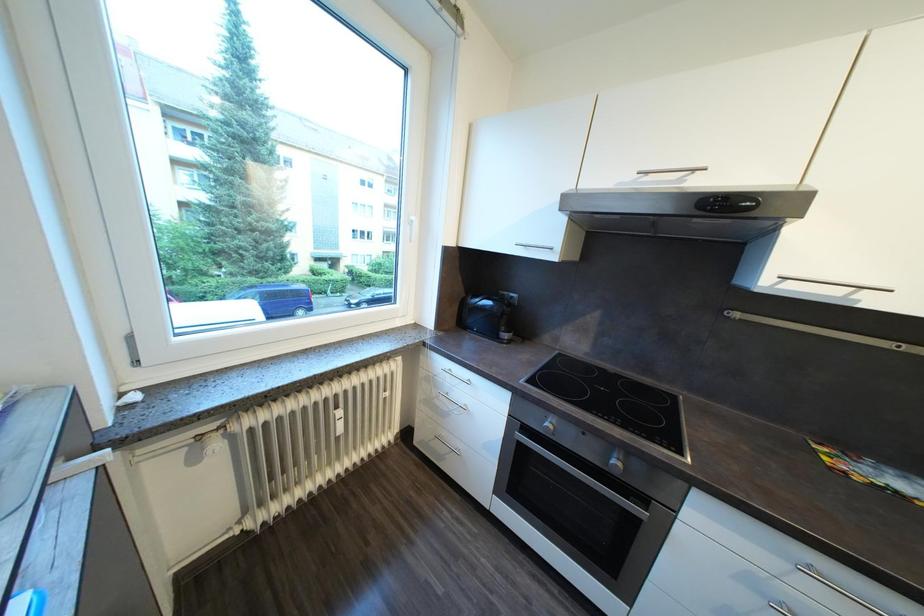
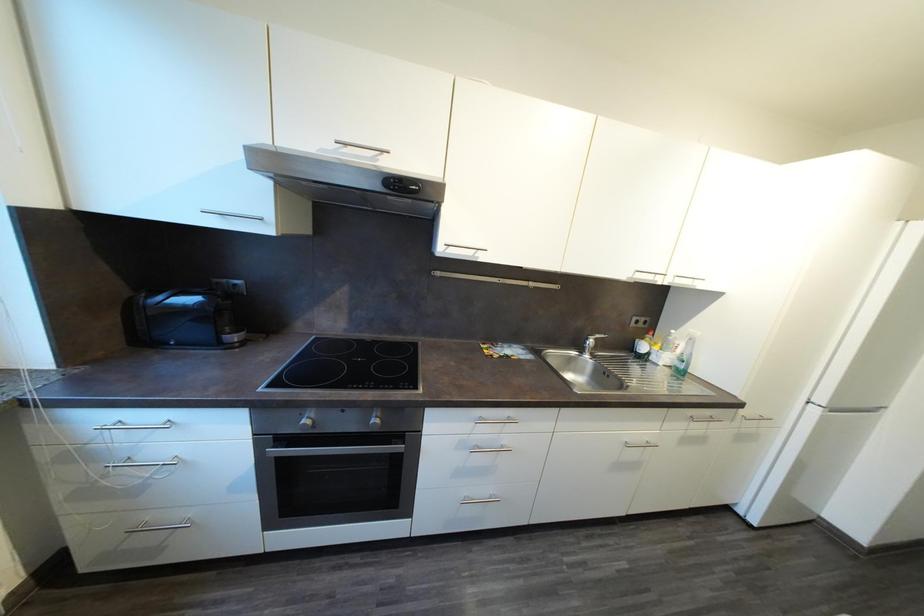
Question: The first image is from the beginning of the video and the second image is from the end. How did the camera likely rotate when shooting the video?

Choices:
 (A) Left
 (B) Right
 (C) Up
 (D) Down

Answer: (B)